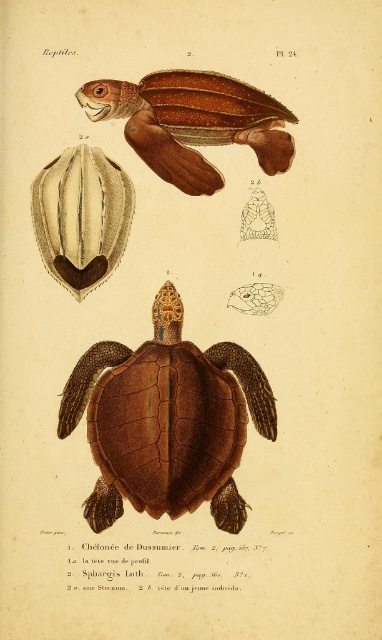
Is brown matte/tough shell at center positioned behind brown glossy shell at upper center?

That is False.

Is brown matte/tough shell at center to the left of brown glossy shell at upper center from the viewer's perspective?

Indeed, brown matte/tough shell at center is positioned on the left side of brown glossy shell at upper center.

Between point (105, 458) and point (163, 81), which one is positioned in front?

Point (105, 458)

You are a GUI agent. You are given a task and a screenshot of the screen. Output one action in this format:
    pyautogui.click(x=<x>, y=<y>)
    Task: Click on the brown matte/tough shell at center
    This screenshot has height=640, width=382.
    Given the screenshot: What is the action you would take?
    pyautogui.click(x=166, y=420)